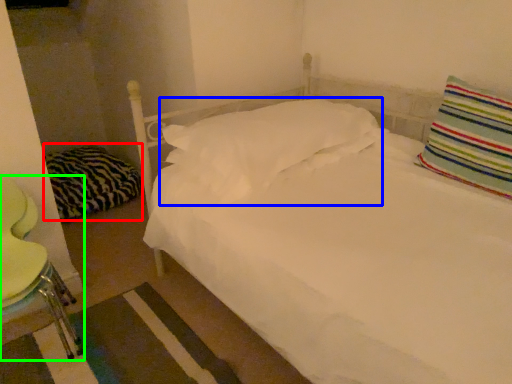
Question: Which object is the closest to the pillow (highlighted by a red box)? Choose among these: pillow (highlighted by a blue box) or swivel chair (highlighted by a green box).

Choices:
 (A) pillow
 (B) swivel chair

Answer: (B)